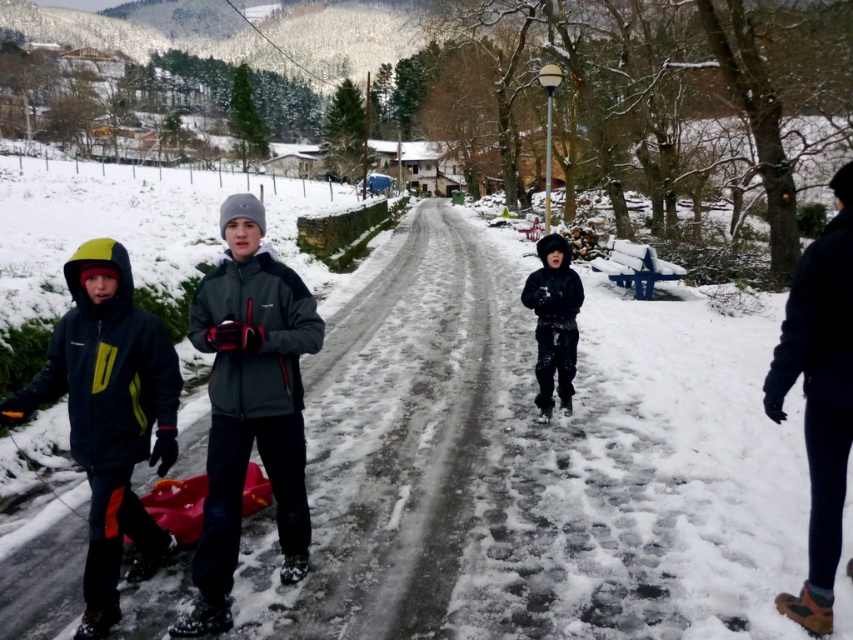
You are standing on the cobblestone road in the snowy scene. You see two points marked in the image. Which point is closer to you, point (x=281, y=458) or point (x=834, y=561)?

Point (x=281, y=458) is closer to you than point (x=834, y=561).

You are standing on the snowy road and see the black matte jacket at left and the dark blue fabric pants at right. Which one is more to the left?

The black matte jacket at left is more to the left.

In the scene shown: You are planning to take a photo of the two children in the snowy scene. The matte gray jacket at center and the black matte jacket at left are both in the frame. Which child should you focus on to ensure they are in the foreground of the photo?

The matte gray jacket at center is much taller than the black matte jacket at left, so focusing on the matte gray jacket at center would place them in the foreground since taller objects are typically closer to the viewer.